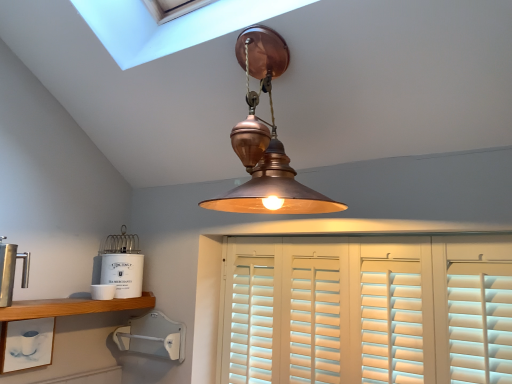
Identify the location of vacant space to the left of white ceramic container at lower left, which appears as the second appliance when ordered from the bottom. This screenshot has height=384, width=512. (60, 299).